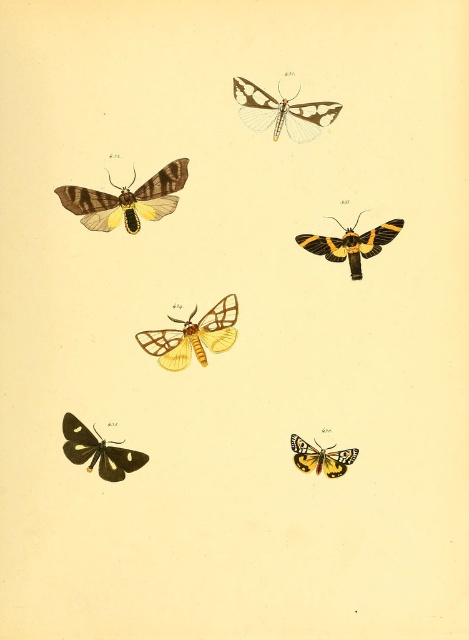
Question: From the image, what is the correct spatial relationship of translucent white and black moth at upper center in relation to yellow-black moth at center?

Choices:
 (A) below
 (B) above

Answer: (B)

Question: Can you confirm if yellow matte butterfly at center is positioned below translucent white and black moth at upper center?

Choices:
 (A) yes
 (B) no

Answer: (A)

Question: Estimate the real-world distances between objects in this image. Which object is farther from the matte yellow and black moth at upper left?

Choices:
 (A) yellow and black spotted butterfly at bottom right
 (B) translucent white and black moth at upper center
 (C) black glossy butterfly at lower left
 (D) yellow matte butterfly at center

Answer: (A)

Question: Can you confirm if matte yellow and black moth at upper left is positioned to the left of black glossy butterfly at lower left?

Choices:
 (A) no
 (B) yes

Answer: (A)

Question: Which object is positioned farthest from the yellow matte butterfly at center?

Choices:
 (A) matte yellow and black moth at upper left
 (B) black glossy butterfly at lower left
 (C) yellow and black spotted butterfly at bottom right

Answer: (C)

Question: Which point is farther to the camera?

Choices:
 (A) black glossy butterfly at lower left
 (B) yellow-black moth at center
 (C) yellow matte butterfly at center

Answer: (C)